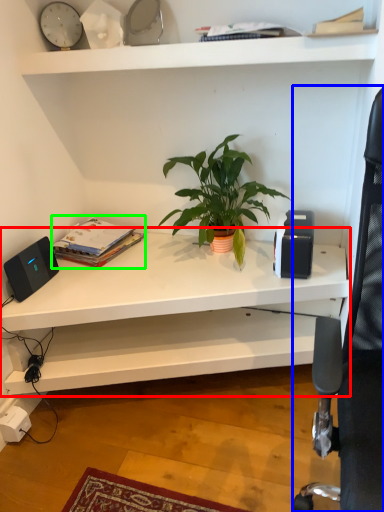
Question: Estimate the real-world distances between objects in this image. Which object is closer to shelf (highlighted by a red box), computer chair (highlighted by a blue box) or paperback book (highlighted by a green box)?

Choices:
 (A) computer chair
 (B) paperback book

Answer: (B)